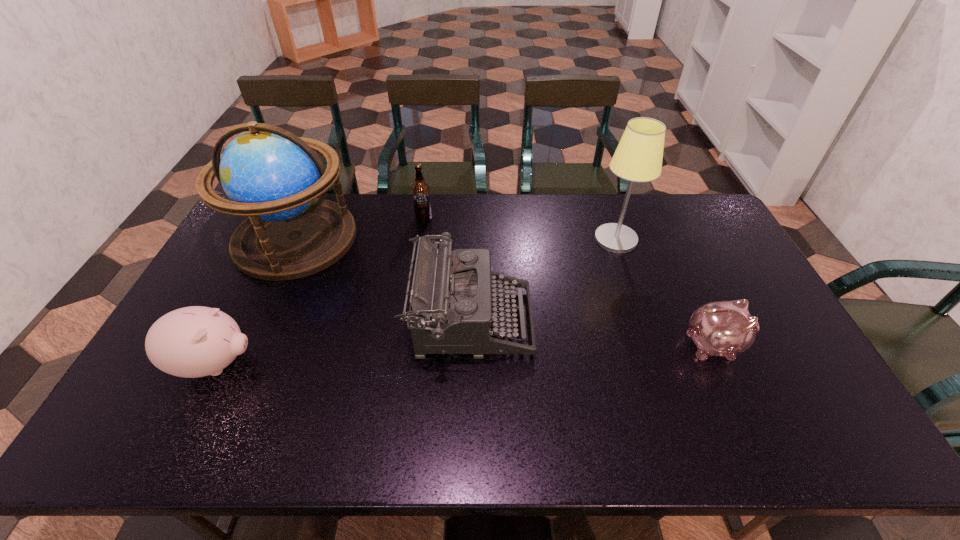
Identify the location of vacant space located 0.180m on the label of the beer bottle. Image resolution: width=960 pixels, height=540 pixels. (418, 258).

The height and width of the screenshot is (540, 960). I want to click on vacant space located on the typing side of the typewriter, so click(667, 321).

At what (x,y) coordinates should I click in order to perform the action: click on vacant space situated at the snout of the fifth tallest object. Please return your answer as a coordinate pair (x, y). This screenshot has height=540, width=960. Looking at the image, I should click on (276, 364).

Image resolution: width=960 pixels, height=540 pixels. I want to click on free space located on the front facing side of the shortest object, so click(x=770, y=345).

Where is `globe that is at the far edge`? The image size is (960, 540). globe that is at the far edge is located at coordinates (269, 174).

Find the location of a particular element. This screenshot has height=540, width=960. table lamp that is at the far edge is located at coordinates (638, 158).

Locate an element on the screen. beer bottle at the far edge is located at coordinates (420, 190).

Identify the location of globe situated at the left edge. The height and width of the screenshot is (540, 960). (269, 174).

Where is `piggy bank at the left edge`? piggy bank at the left edge is located at coordinates (196, 341).

Locate an element on the screen. Image resolution: width=960 pixels, height=540 pixels. object present at the right edge is located at coordinates (719, 328).